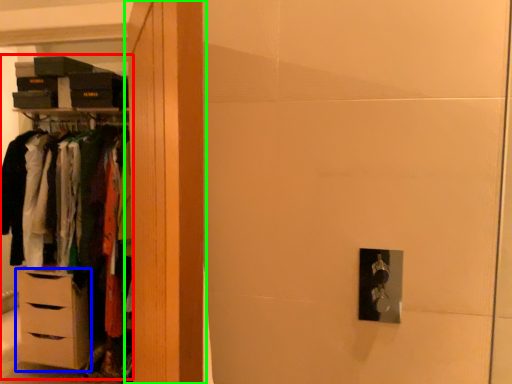
Question: Which object is positioned closest to dresser (highlighted by a red box)? Select from chest of drawers (highlighted by a blue box) and armoire (highlighted by a green box).

Choices:
 (A) chest of drawers
 (B) armoire

Answer: (A)